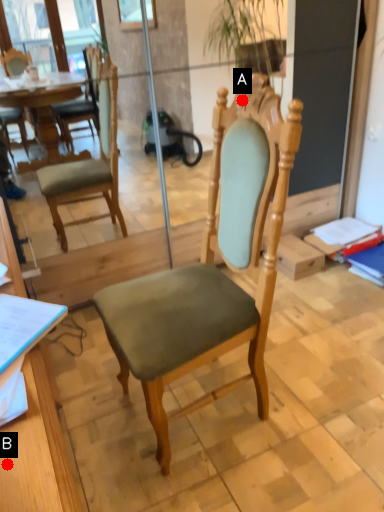
Question: Two points are circled on the image, labeled by A and B beside each circle. Which of the following is the closest to the observer?

Choices:
 (A) A is closer
 (B) B is closer

Answer: (B)